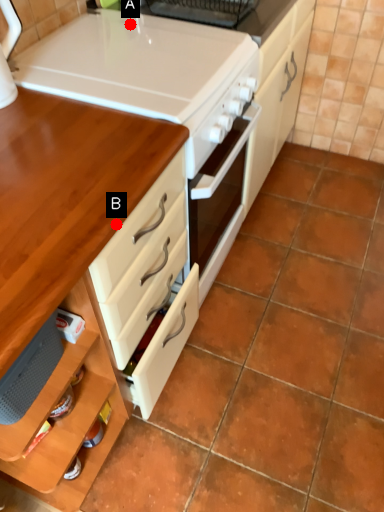
Question: Two points are circled on the image, labeled by A and B beside each circle. Which point is closer to the camera?

Choices:
 (A) A is closer
 (B) B is closer

Answer: (B)